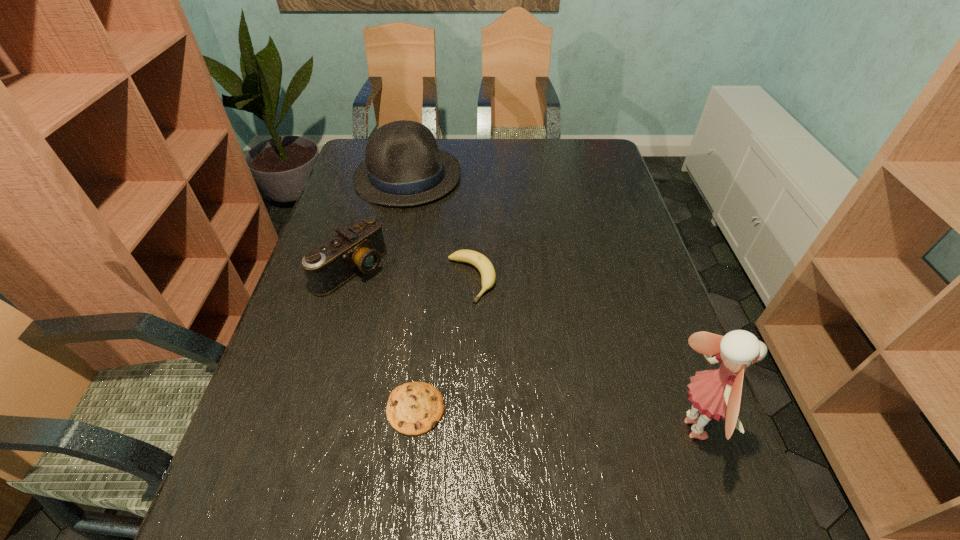
The width and height of the screenshot is (960, 540). In order to click on the shortest object in this screenshot , I will do `click(414, 408)`.

Where is `doll`? This screenshot has width=960, height=540. doll is located at coordinates (716, 393).

Find the location of a particular element. This screenshot has height=540, width=960. the tallest object is located at coordinates (716, 393).

Identify the location of the second shortest object. (488, 276).

I want to click on camera, so click(x=359, y=248).

The height and width of the screenshot is (540, 960). In order to click on the second tallest object in this screenshot , I will do `click(403, 167)`.

This screenshot has width=960, height=540. Identify the location of the farthest object. (403, 167).

Locate an element on the screen. This screenshot has width=960, height=540. free region located 0.260m on the left of the cookie is located at coordinates (260, 409).

Where is `vacant space located at the stem of the banana`? The width and height of the screenshot is (960, 540). vacant space located at the stem of the banana is located at coordinates (577, 440).

Identify the location of blank space located 0.240m at the stem of the banana. (534, 376).